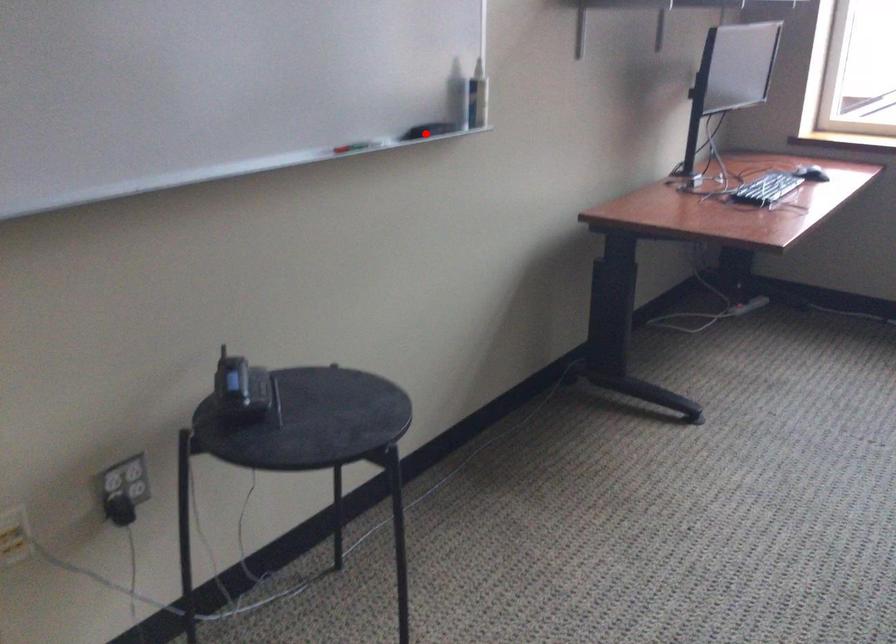
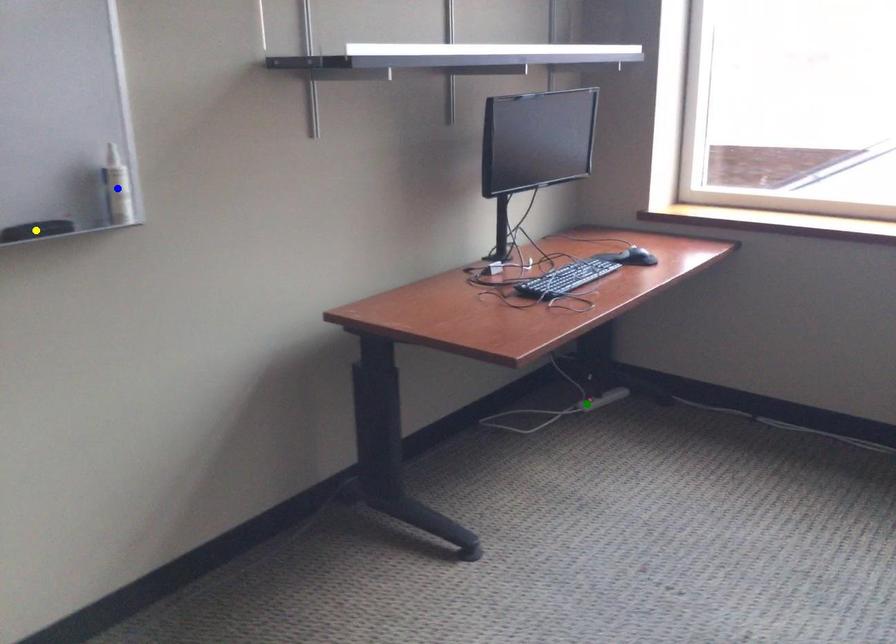
Question: I am providing you with two images of the same scene from different viewpoints. A red point is marked on the first image. You are given multiple points on the second image. Which point in image 2 represents the same 3d spot as the red point in image 1?

Choices:
 (A) blue point
 (B) yellow point
 (C) green point

Answer: (B)